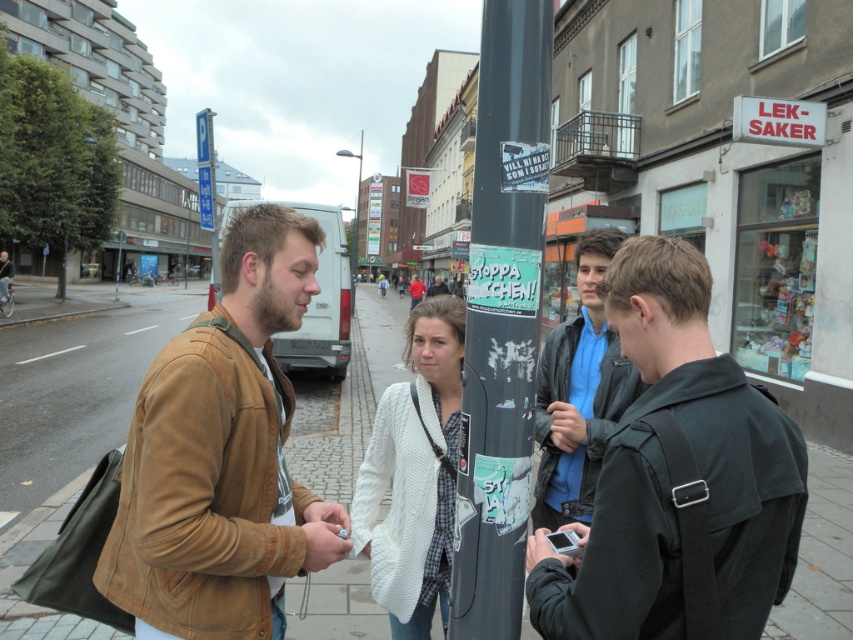
Question: Which object is positioned closest to the dark gray jacket at center?

Choices:
 (A) brown suede jacket at left
 (B) dark gray pole at center
 (C) cobblestone pavement at lower center

Answer: (B)

Question: Can you confirm if dark gray pole at center is positioned below light brown leather jacket at center?

Choices:
 (A) no
 (B) yes

Answer: (B)

Question: Which point is farther to the camera?

Choices:
 (A) (442, 284)
 (B) (410, 307)

Answer: (B)

Question: Is dark gray jacket at center bigger than dark gray pole at center?

Choices:
 (A) no
 (B) yes

Answer: (B)

Question: Is brown suede jacket at left wider than cobblestone pavement at lower center?

Choices:
 (A) yes
 (B) no

Answer: (B)

Question: Which object appears farthest from the camera in this image?

Choices:
 (A) dark gray pole at center
 (B) light brown leather jacket at center
 (C) brown suede jacket at left
 (D) red cotton shirt at center

Answer: (D)